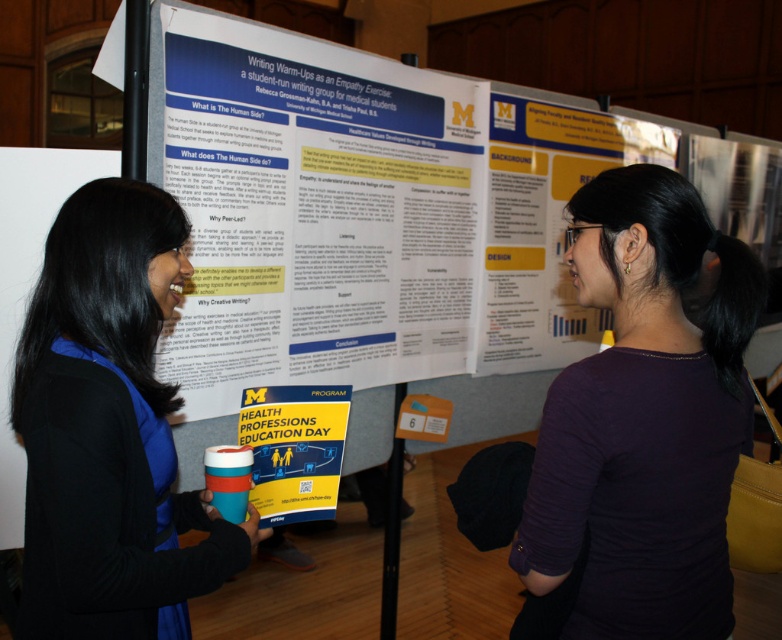
Question: Is purple matte shirt at center positioned at the back of yellow paper program at center?

Choices:
 (A) no
 (B) yes

Answer: (A)

Question: Which object is farther from the camera taking this photo?

Choices:
 (A) blue fabric shirt at left
 (B) white paper poster at center
 (C) purple matte shirt at center
 (D) yellow paper program at center

Answer: (B)

Question: Is purple matte shirt at center wider than blue fabric shirt at left?

Choices:
 (A) no
 (B) yes

Answer: (B)

Question: Is white paper poster at center behind purple matte shirt at center?

Choices:
 (A) yes
 (B) no

Answer: (A)

Question: Which point is farther to the camera?

Choices:
 (A) (189, 225)
 (B) (332, 420)
 (C) (712, 413)

Answer: (B)

Question: Which object appears farthest from the camera in this image?

Choices:
 (A) purple matte shirt at center
 (B) white paper poster at center
 (C) blue fabric shirt at left

Answer: (B)